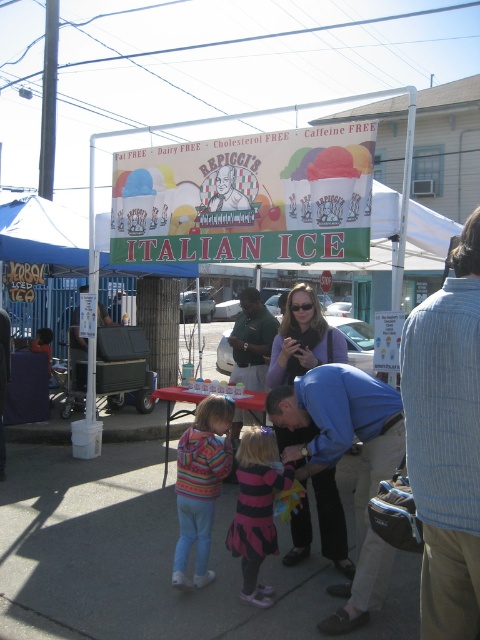
Question: Can you confirm if matte purple sweater at center is positioned to the left of striped sweater at center?

Choices:
 (A) yes
 (B) no

Answer: (B)

Question: Which point appears farthest from the camera in this image?

Choices:
 (A) tap(336, 356)
 (B) tap(245, 320)
 (C) tap(428, 541)
 (D) tap(357, 572)

Answer: (B)

Question: Estimate the real-world distances between objects in this image. Which object is closer to the green fabric sign at center?

Choices:
 (A) blue cotton shirt at center
 (B) matte purple sweater at center
 (C) blue striped shirt at center
 (D) green cotton shirt at center

Answer: (B)

Question: Is matte purple sweater at center to the left of striped fabric dress at center from the viewer's perspective?

Choices:
 (A) no
 (B) yes

Answer: (A)

Question: Does blue striped shirt at center appear under striped sweater at center?

Choices:
 (A) no
 (B) yes

Answer: (A)

Question: Which point appears farthest from the camera in this image?

Choices:
 (A) (433, 438)
 (B) (0, 456)
 (C) (186, 481)
 (D) (261, 342)

Answer: (D)